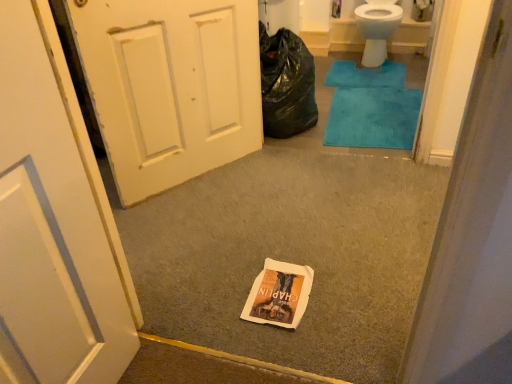
Question: Should I look upward or downward to see white painted wood door at left?

Choices:
 (A) down
 (B) up

Answer: (B)

Question: From a real-world perspective, is white paper bag at center located higher than teal plush bath mat at center, acting as the first bath mat starting from the bottom?

Choices:
 (A) no
 (B) yes

Answer: (B)

Question: Does white paper bag at center turn towards teal plush bath mat at center, acting as the first bath mat starting from the bottom?

Choices:
 (A) yes
 (B) no

Answer: (B)

Question: Can you confirm if white paper bag at center is shorter than teal plush bath mat at center, acting as the 2th bath mat starting from the back?

Choices:
 (A) yes
 (B) no

Answer: (B)

Question: From the image's perspective, is white paper bag at center located above teal plush bath mat at center, acting as the 2th bath mat starting from the back?

Choices:
 (A) yes
 (B) no

Answer: (B)

Question: Is teal plush bath mat at center, acting as the first bath mat starting from the bottom, surrounded by white paper bag at center?

Choices:
 (A) yes
 (B) no

Answer: (B)

Question: Considering the relative sizes of white paper bag at center and teal plush bath mat at center, acting as the 2th bath mat starting from the back, in the image provided, is white paper bag at center wider than teal plush bath mat at center, acting as the 2th bath mat starting from the back,?

Choices:
 (A) yes
 (B) no

Answer: (A)

Question: Could white paper bag at center be considered to be inside blue plush bath mat at upper right, which is counted as the first bath mat, starting from the top?

Choices:
 (A) no
 (B) yes

Answer: (A)

Question: Considering the relative sizes of blue plush bath mat at upper right, which is counted as the first bath mat, starting from the top, and white paper bag at center in the image provided, is blue plush bath mat at upper right, which is counted as the first bath mat, starting from the top, bigger than white paper bag at center?

Choices:
 (A) no
 (B) yes

Answer: (B)

Question: Is blue plush bath mat at upper right, positioned as the second bath mat in bottom-to-top order, further to camera compared to white paper bag at center?

Choices:
 (A) yes
 (B) no

Answer: (A)

Question: Is blue plush bath mat at upper right, positioned as the second bath mat in bottom-to-top order, not close to white paper bag at center?

Choices:
 (A) no
 (B) yes

Answer: (B)

Question: From the image's perspective, is blue plush bath mat at upper right, positioned as the second bath mat in bottom-to-top order, located above white paper bag at center?

Choices:
 (A) yes
 (B) no

Answer: (A)

Question: Is blue plush bath mat at upper right, positioned as the second bath mat in bottom-to-top order, closer to camera compared to white paper bag at center?

Choices:
 (A) no
 (B) yes

Answer: (A)

Question: Is white painted wood door at left smaller than white paper bag at center?

Choices:
 (A) no
 (B) yes

Answer: (A)